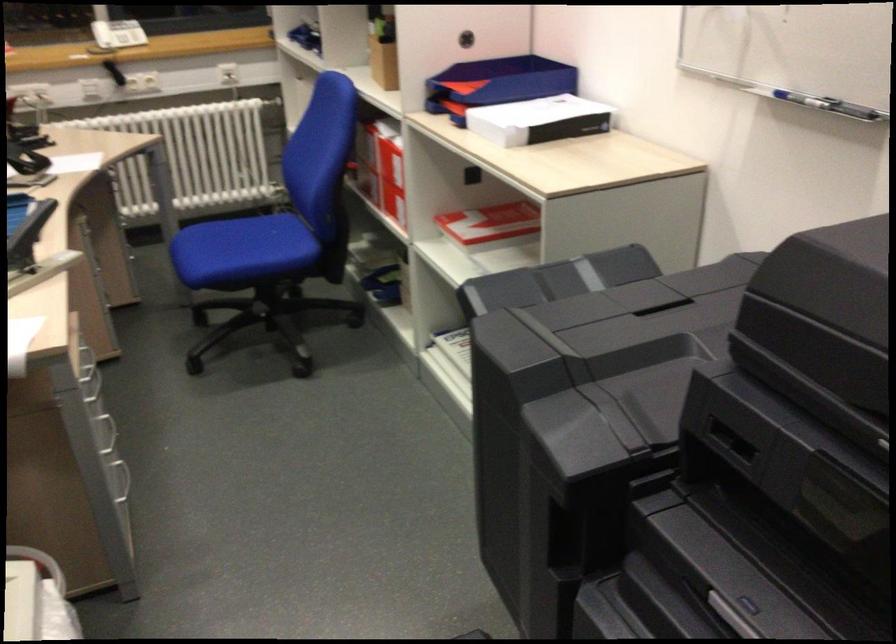
At what (x,y) coordinates should I click in order to perform the action: click on white telephone handset. Please return your answer as a coordinate pair (x, y). The height and width of the screenshot is (644, 896). Looking at the image, I should click on (117, 33).